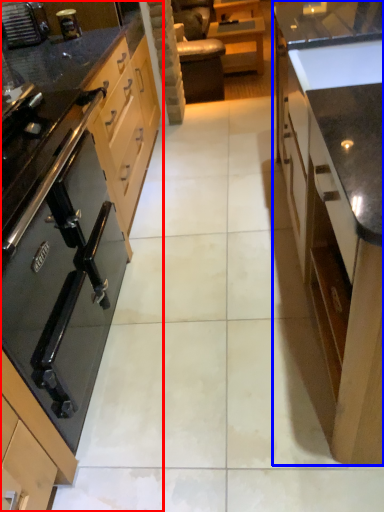
Question: Which point is closer to the camera, cabinetry (highlighted by a red box) or cabinetry (highlighted by a blue box)?

Choices:
 (A) cabinetry
 (B) cabinetry

Answer: (B)